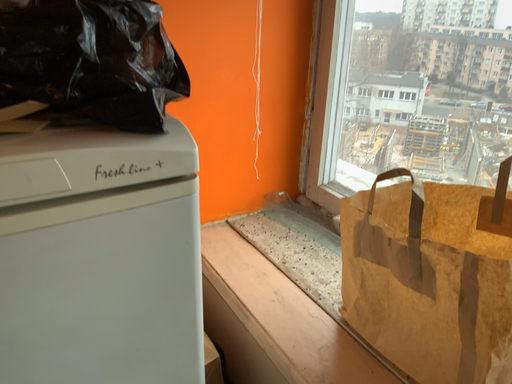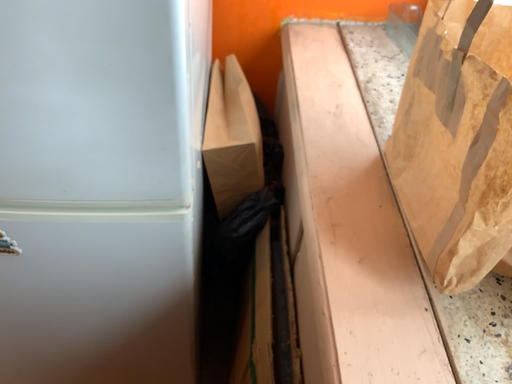
Question: How did the camera likely rotate when shooting the video?

Choices:
 (A) rotated downward
 (B) rotated upward

Answer: (A)